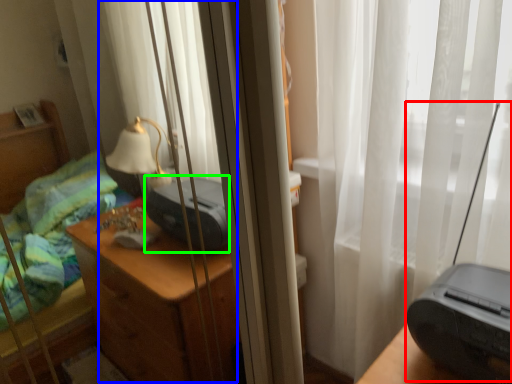
Question: Based on their relative distances, which object is farther from equipment (highlighted by a red box)? Choose from curtain (highlighted by a blue box) and printer (highlighted by a green box).

Choices:
 (A) curtain
 (B) printer

Answer: (A)